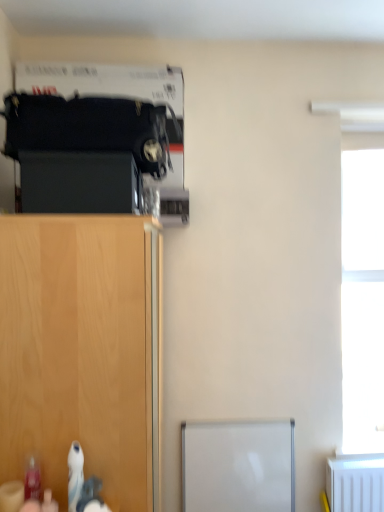
Question: Can you confirm if wooden cabinet at lower left is thinner than black matte cabinet at left?

Choices:
 (A) yes
 (B) no

Answer: (B)

Question: Is wooden cabinet at lower left at the right side of black matte cabinet at left?

Choices:
 (A) yes
 (B) no

Answer: (B)

Question: Is wooden cabinet at lower left further to the viewer compared to black matte cabinet at left?

Choices:
 (A) yes
 (B) no

Answer: (B)

Question: Are wooden cabinet at lower left and black matte cabinet at left located far from each other?

Choices:
 (A) yes
 (B) no

Answer: (B)

Question: Considering the relative sizes of wooden cabinet at lower left and black matte cabinet at left in the image provided, is wooden cabinet at lower left shorter than black matte cabinet at left?

Choices:
 (A) yes
 (B) no

Answer: (B)

Question: Would you say transparent glass window at right is to the left or to the right of wooden cabinet at lower left in the picture?

Choices:
 (A) left
 (B) right

Answer: (B)

Question: From a real-world perspective, is transparent glass window at right positioned above or below wooden cabinet at lower left?

Choices:
 (A) above
 (B) below

Answer: (A)

Question: From the image's perspective, relative to wooden cabinet at lower left, is transparent glass window at right above or below?

Choices:
 (A) above
 (B) below

Answer: (A)

Question: Is transparent glass window at right taller or shorter than wooden cabinet at lower left?

Choices:
 (A) short
 (B) tall

Answer: (B)

Question: Considering the positions of wooden cabinet at lower left and black matte cabinet at left in the image, is wooden cabinet at lower left taller or shorter than black matte cabinet at left?

Choices:
 (A) short
 (B) tall

Answer: (B)

Question: Which is correct: wooden cabinet at lower left is inside black matte cabinet at left, or outside of it?

Choices:
 (A) outside
 (B) inside

Answer: (A)

Question: Is point (104, 219) positioned closer to the camera than point (130, 181)?

Choices:
 (A) farther
 (B) closer

Answer: (B)

Question: Is wooden cabinet at lower left in front of or behind black matte cabinet at left in the image?

Choices:
 (A) behind
 (B) front

Answer: (B)

Question: Relative to transparent glass window at right, is black matte cabinet at left in front or behind?

Choices:
 (A) front
 (B) behind

Answer: (A)

Question: Is black matte cabinet at left inside or outside of transparent glass window at right?

Choices:
 (A) outside
 (B) inside

Answer: (A)